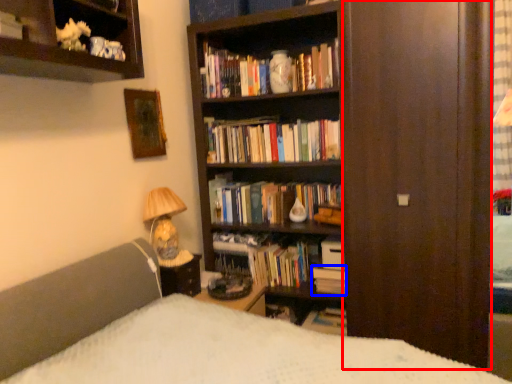
Question: Which point is further to the camera, screen door (highlighted by a red box) or book (highlighted by a blue box)?

Choices:
 (A) screen door
 (B) book

Answer: (B)